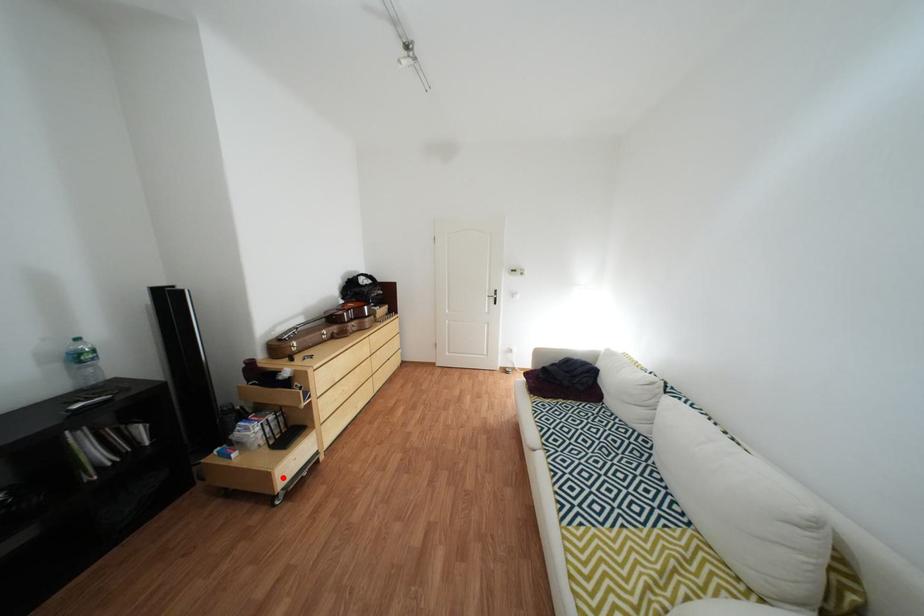
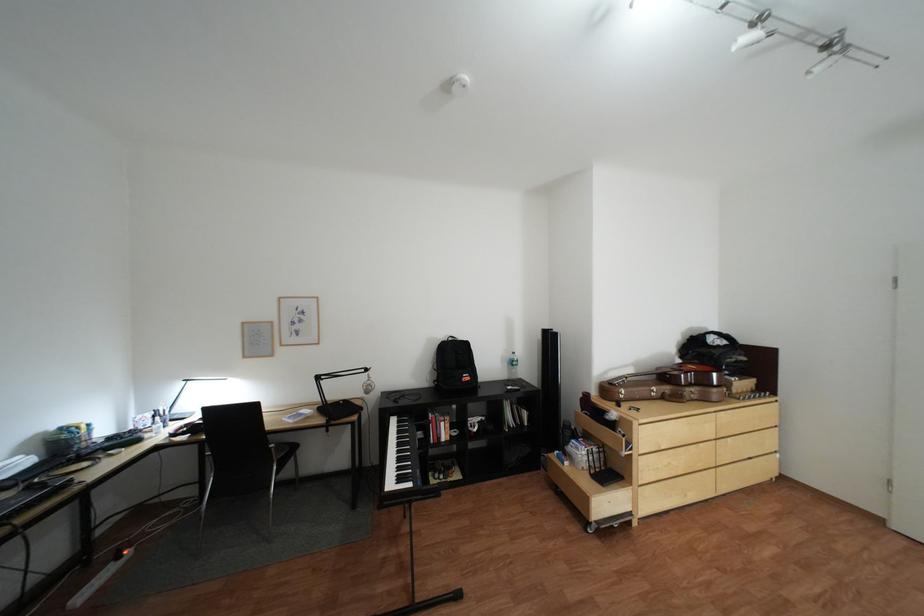
Locate, in the second image, the point that corresponds to the highlighted location in the first image.

(602, 500)